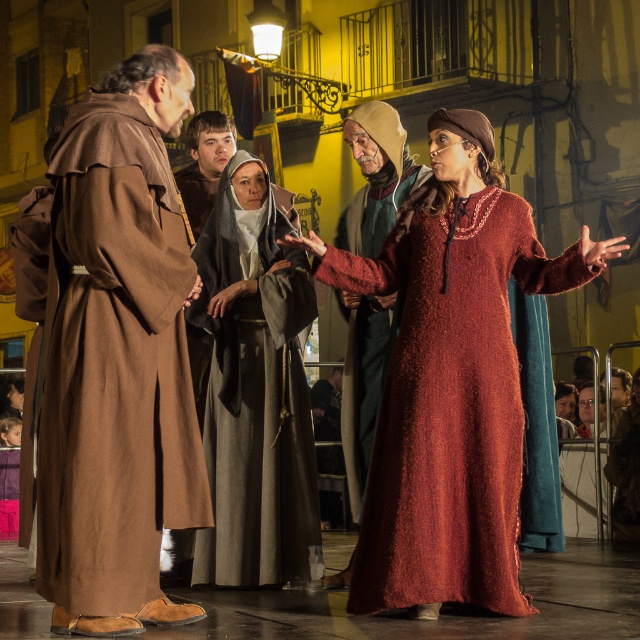
Which of these two, knitted wool dress at center or velvet-like red dress at center, stands taller?

With more height is knitted wool dress at center.

Between point (365, 570) and point (362, 248), which one is positioned in front?

Positioned in front is point (365, 570).

Image resolution: width=640 pixels, height=640 pixels. I want to click on knitted wool dress at center, so click(451, 380).

Describe the element at coordinates (451, 380) in the screenshot. The width and height of the screenshot is (640, 640). I see `knitted wool dress at center` at that location.

Who is shorter, knitted wool dress at center or brown woolen robe at center?

knitted wool dress at center is shorter.

Where is `knitted wool dress at center`? The width and height of the screenshot is (640, 640). knitted wool dress at center is located at coordinates (451, 380).

Who is lower down, brown woolen robe at left or knitted wool dress at center?

knitted wool dress at center

Can you confirm if brown woolen robe at left is positioned to the right of knitted wool dress at center?

In fact, brown woolen robe at left is to the left of knitted wool dress at center.

Is point (52, 288) positioned in front of point (440, 474)?

That is True.

Locate an element on the screen. brown woolen robe at left is located at coordinates (116, 356).